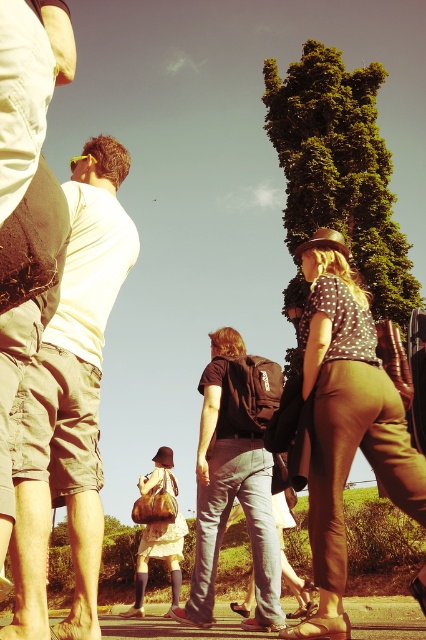
Question: Can you confirm if matte khaki shorts at left is bigger than dark gray jeans at center?

Choices:
 (A) no
 (B) yes

Answer: (A)

Question: Which is farther from the dark gray jeans at center?

Choices:
 (A) matte brown leather bag at center
 (B) concrete pavement at lower center
 (C) brown leather pants at right
 (D) matte khaki shorts at left

Answer: (A)

Question: Where is brown leather pants at right located in relation to matte brown leather bag at center in the image?

Choices:
 (A) below
 (B) above

Answer: (B)

Question: Is matte khaki shorts at left to the left of brown leather pants at right from the viewer's perspective?

Choices:
 (A) no
 (B) yes

Answer: (B)

Question: Estimate the real-world distances between objects in this image. Which object is farther from the dark gray jeans at center?

Choices:
 (A) matte brown leather bag at center
 (B) brown leather pants at right

Answer: (A)

Question: Which point is closer to the camera taking this photo?

Choices:
 (A) (397, 496)
 (B) (241, 506)
 (C) (112, 164)
 (D) (149, 476)

Answer: (A)